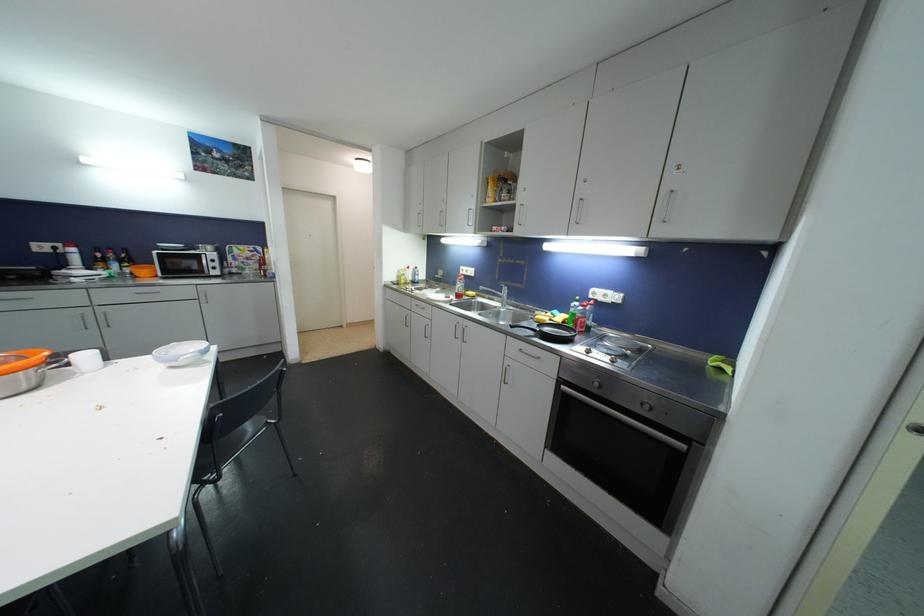
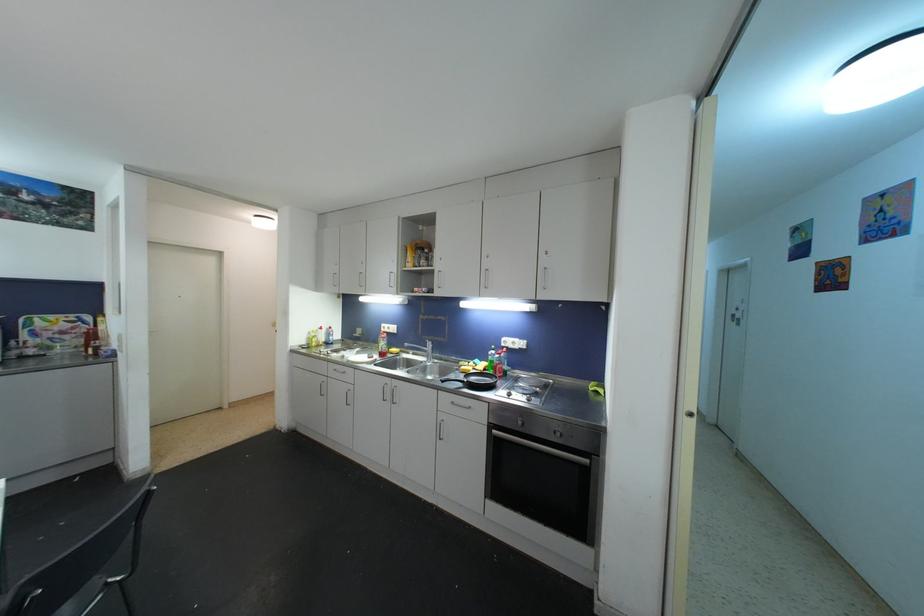
Question: How did the camera likely rotate?

Choices:
 (A) Left
 (B) Right
 (C) Up
 (D) Down

Answer: (B)